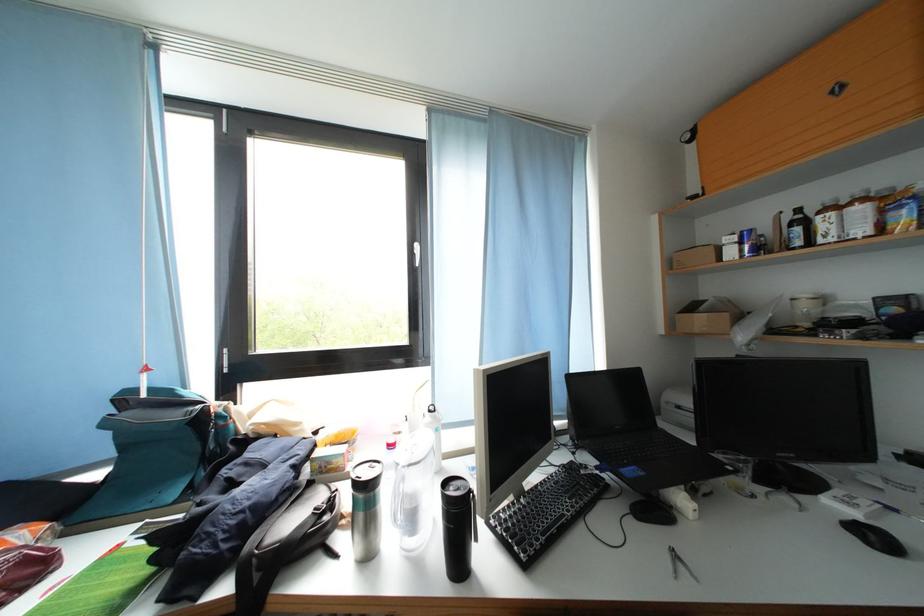
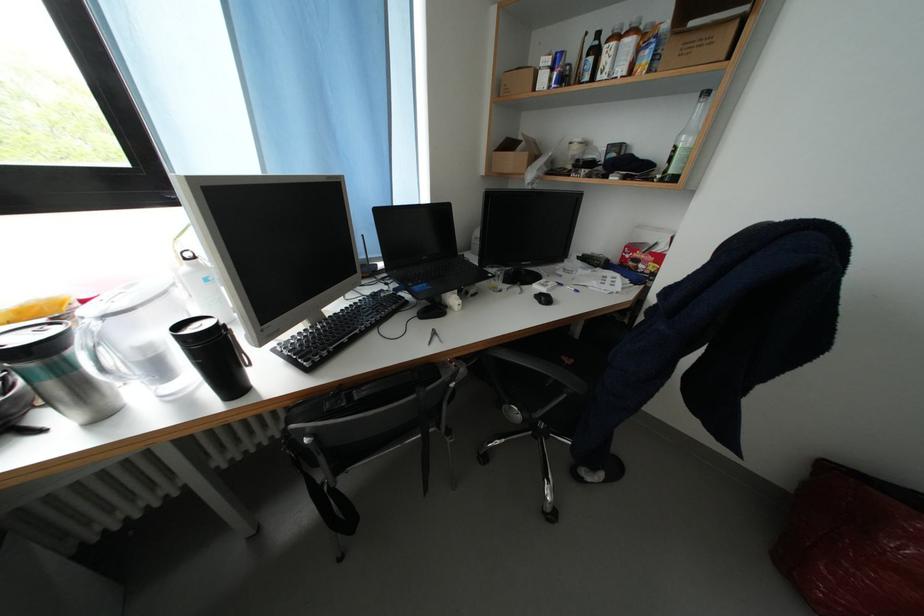
In the second image, find the point that corresponds to (454,488) in the first image.

(188, 330)